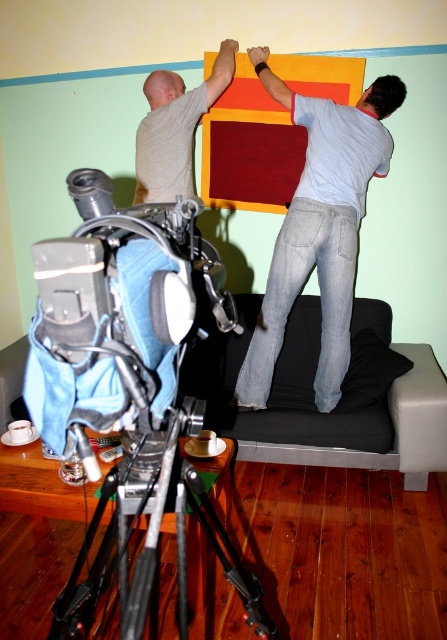
You are a delivery person who needs to place a package on the floor between the black fabric couch at lower right and the teal stripe on the wall. The package requires 1.5 meters of space to be safely placed. Can you fit it there?

The distance between the black fabric couch at lower right and the teal stripe on the wall is 2.36 meters, which is more than enough to safely place the package requiring 1.5 meters of space.

You are standing in the room and want to sit down on the black fabric couch at lower right. However, there is a black metal tripod at lower left blocking your path. Can you easily walk around the tripod to reach the couch?

The black fabric couch at lower right is much taller than the black metal tripod at lower left, so you can easily walk around the tripod since it is shorter and less obstructive.

Looking at this image, you are a photographer setting up equipment in the room. You have two tripods, the metallic silver tripod at lower left and the black metal tripod at lower left. You need to choose one to hold a camera that requires a taller support. Which tripod should you choose?

The black metal tripod at lower left is taller than the metallic silver tripod at lower left, so you should choose the black metal tripod at lower left to hold the camera that requires a taller support.